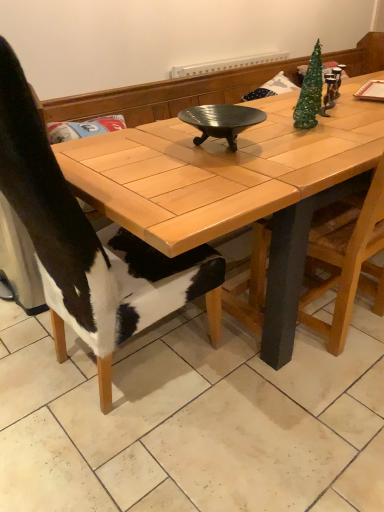
Question: Is black ribbed metal wok at center aimed at wooden table at center?

Choices:
 (A) yes
 (B) no

Answer: (B)

Question: From the image's perspective, is black ribbed metal wok at center beneath wooden table at center?

Choices:
 (A) yes
 (B) no

Answer: (B)

Question: Is black ribbed metal wok at center next to wooden table at center?

Choices:
 (A) yes
 (B) no

Answer: (B)

Question: Does black ribbed metal wok at center have a greater width compared to wooden table at center?

Choices:
 (A) yes
 (B) no

Answer: (B)

Question: Is black ribbed metal wok at center facing away from wooden table at center?

Choices:
 (A) yes
 (B) no

Answer: (B)

Question: Looking at their shapes, would you say black ribbed metal wok at center is wider or thinner than cowhide at left, marked as the 2th chair in a right-to-left arrangement?

Choices:
 (A) thin
 (B) wide

Answer: (A)

Question: Considering the positions of point (248, 122) and point (39, 168), is point (248, 122) closer or farther from the camera than point (39, 168)?

Choices:
 (A) farther
 (B) closer

Answer: (A)

Question: Relative to cowhide at left, which ranks as the first chair in left-to-right order, is black ribbed metal wok at center in front or behind?

Choices:
 (A) front
 (B) behind

Answer: (B)

Question: Which is correct: black ribbed metal wok at center is inside cowhide at left, which ranks as the first chair in left-to-right order, or outside of it?

Choices:
 (A) outside
 (B) inside

Answer: (A)

Question: Would you say wooden chair at right, the 1th chair in the right-to-left sequence, is to the left or to the right of wooden table at center in the picture?

Choices:
 (A) right
 (B) left

Answer: (B)

Question: Considering the positions of wooden chair at right, the 1th chair in the right-to-left sequence, and wooden table at center in the image, is wooden chair at right, the 1th chair in the right-to-left sequence, wider or thinner than wooden table at center?

Choices:
 (A) thin
 (B) wide

Answer: (A)

Question: From the image's perspective, relative to wooden table at center, is wooden chair at right, the 1th chair in the right-to-left sequence, above or below?

Choices:
 (A) above
 (B) below

Answer: (B)

Question: Is wooden chair at right, which ranks as the second chair in left-to-right order, spatially inside wooden table at center, or outside of it?

Choices:
 (A) outside
 (B) inside

Answer: (B)

Question: From the image's perspective, is wooden chair at right, the 1th chair in the right-to-left sequence, above or below cowhide at left, which ranks as the first chair in left-to-right order?

Choices:
 (A) below
 (B) above

Answer: (B)

Question: Is point (374, 311) closer or farther from the camera than point (31, 238)?

Choices:
 (A) farther
 (B) closer

Answer: (A)